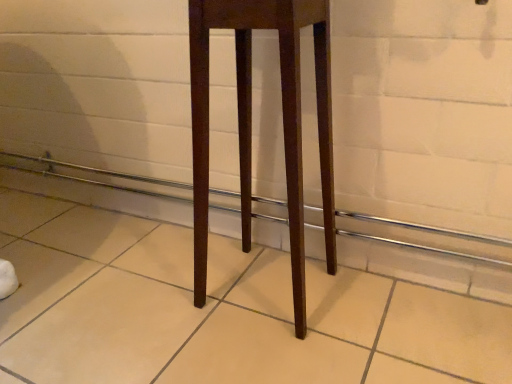
Locate an element on the screen. free area below brown wooden balustrade at center (from a real-world perspective) is located at coordinates (185, 233).